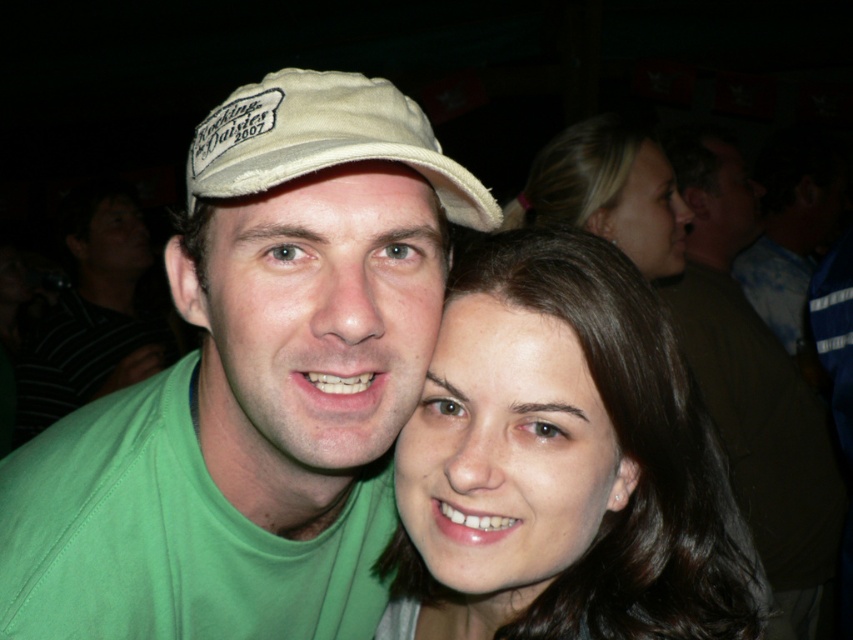
Can you confirm if smooth brown hair at center is taller than green fabric shirt at left?

In fact, smooth brown hair at center may be shorter than green fabric shirt at left.

Between point (734, 570) and point (91, 376), which one is positioned in front?

Point (734, 570) is in front.

Locate an element on the screen. smooth brown hair at center is located at coordinates (561, 464).

Identify the location of smooth brown hair at center. (561, 464).

Based on the photo, between matte khaki cap at center and smooth skin face at upper right, which one is positioned higher?

smooth skin face at upper right

What do you see at coordinates (254, 387) in the screenshot? I see `matte khaki cap at center` at bounding box center [254, 387].

Locate an element on the screen. The height and width of the screenshot is (640, 853). matte khaki cap at center is located at coordinates (254, 387).

You are a GUI agent. You are given a task and a screenshot of the screen. Output one action in this format:
    pyautogui.click(x=<x>, y=<y>)
    Task: Click on the matte beige cap at center
    
    Given the screenshot: What is the action you would take?
    click(315, 323)

Can you confirm if matte beige cap at center is positioned to the left of smooth skin face at center?

Correct, you'll find matte beige cap at center to the left of smooth skin face at center.

Who is more forward, [322,445] or [535,576]?

Point [322,445] is more forward.

Locate an element on the screen. The image size is (853, 640). matte beige cap at center is located at coordinates coord(315,323).